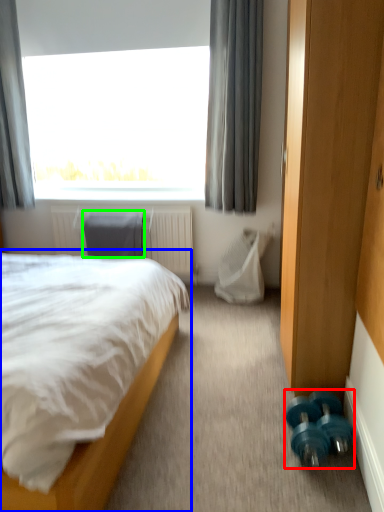
Question: Which object is positioned farthest from dumbbell (highlighted by a red box)? Select from bed (highlighted by a blue box) and swivel chair (highlighted by a green box).

Choices:
 (A) bed
 (B) swivel chair

Answer: (B)